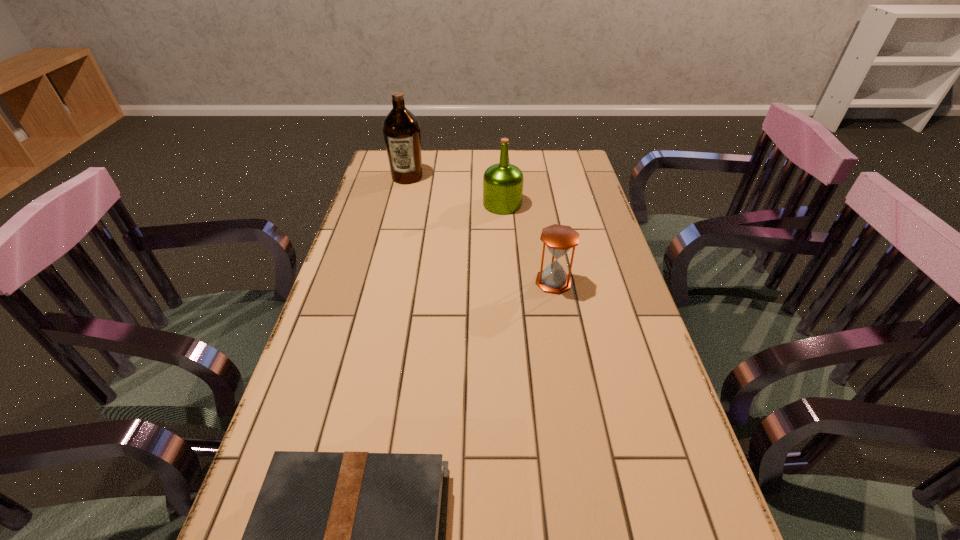
This screenshot has width=960, height=540. I want to click on object that is positioned at the left edge, so click(x=401, y=129).

In order to click on object that is at the right edge in this screenshot , I will do `click(559, 239)`.

What are the coordinates of `object at the far left corner` in the screenshot? It's located at (401, 129).

The width and height of the screenshot is (960, 540). I want to click on vacant space at the far edge, so click(x=450, y=169).

In the image, there is a desktop. Where is `vacant space at the left edge`? vacant space at the left edge is located at coordinates (413, 186).

Locate an element on the screen. The image size is (960, 540). blank space at the right edge of the desktop is located at coordinates (655, 477).

Identify the location of vacant space at the far right corner of the desktop. Image resolution: width=960 pixels, height=540 pixels. (552, 158).

Locate an element on the screen. vacant area that lies between the tallest object and the hourglass is located at coordinates (480, 230).

I want to click on vacant region between the rightmost object and the farther olive oil, so click(x=480, y=230).

This screenshot has width=960, height=540. I want to click on empty space between the second shortest object and the right olive oil, so click(x=528, y=243).